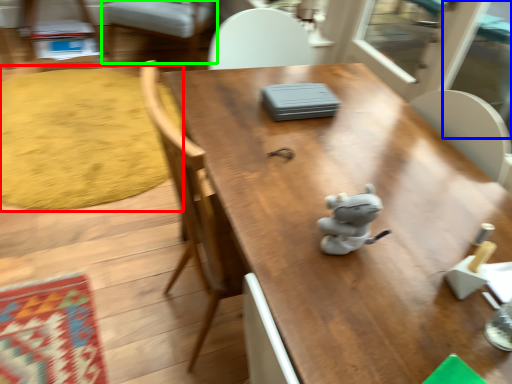
Question: Estimate the real-world distances between objects in this image. Which object is closer to mat (highlighted by a red box), screen door (highlighted by a blue box) or chair (highlighted by a green box)?

Choices:
 (A) screen door
 (B) chair

Answer: (B)